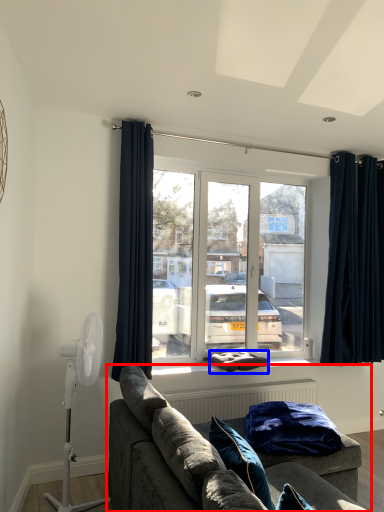
Question: Which object appears farthest to the camera in this image, studio couch (highlighted by a red box) or pillow (highlighted by a blue box)?

Choices:
 (A) studio couch
 (B) pillow

Answer: (B)